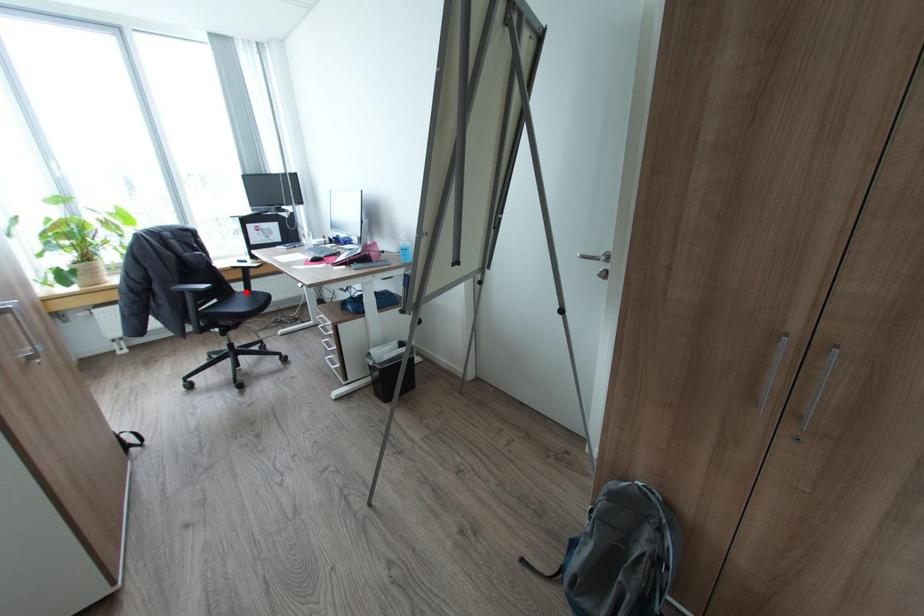
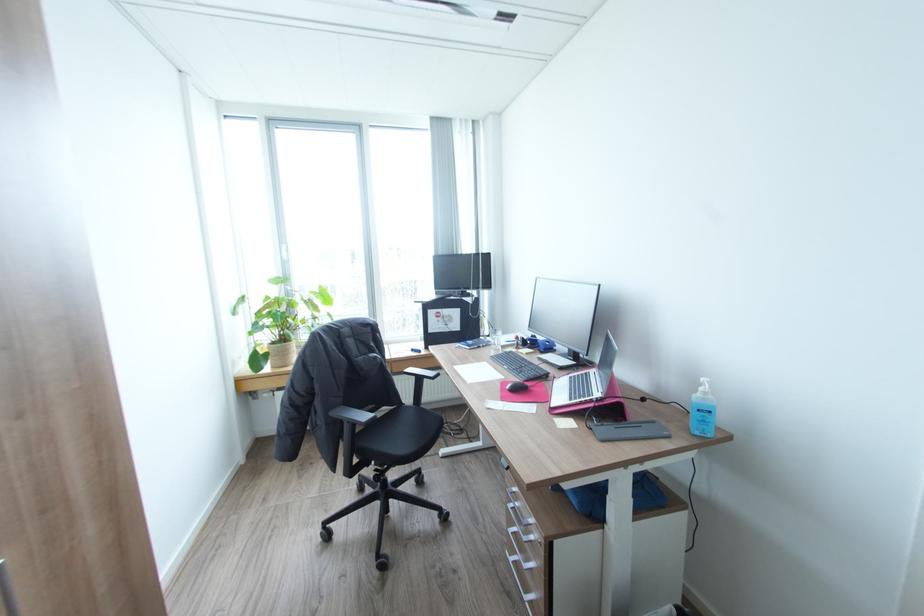
Question: I am providing you with two images of the same scene from different viewpoints. Image1 has a red point marked. In image2, the corresponding 3D location appears at what relative position? Reply with the corresponding letter.

Choices:
 (A) Closer
 (B) Farther

Answer: (B)